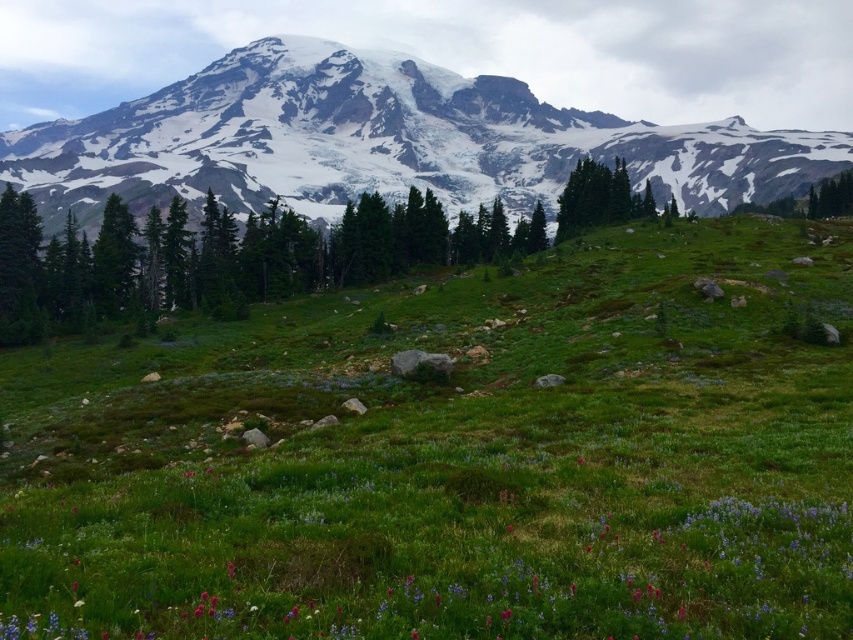
Does point (350, 166) come behind point (160, 273)?

Yes, point (350, 166) is farther from viewer.

This screenshot has height=640, width=853. What do you see at coordinates (383, 141) in the screenshot? I see `snowy granite mountain at upper center` at bounding box center [383, 141].

Locate an element on the screen. snowy granite mountain at upper center is located at coordinates (383, 141).

Find the location of a particular element. snowy granite mountain at upper center is located at coordinates (383, 141).

In the scene shown: Can you confirm if green grassy field at center is shorter than green matte tree at center?

Indeed, green grassy field at center has a lesser height compared to green matte tree at center.

Is green grassy field at center closer to the viewer compared to green matte tree at center?

Yes, green grassy field at center is closer to the viewer.

Who is more distant from viewer, (196, 376) or (225, 218)?

The point (225, 218) is more distant.

In order to click on green grassy field at center in this screenshot , I will do pos(456,460).

Is point (552, 276) positioned before point (671, 141)?

That is True.

The image size is (853, 640). In order to click on green grassy field at center in this screenshot , I will do `click(456, 460)`.

The height and width of the screenshot is (640, 853). Find the location of `green grassy field at center`. green grassy field at center is located at coordinates (456, 460).